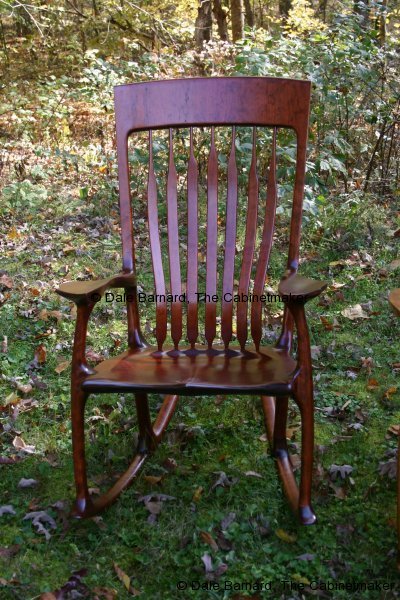
Image resolution: width=400 pixels, height=600 pixels. Identify the location of left rocker of rocking chair. (288, 484).